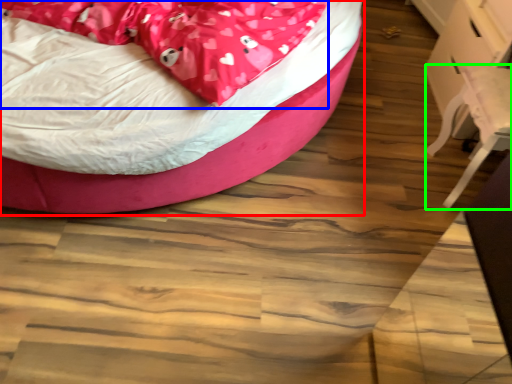
Question: Which object is positioned closest to bed (highlighted by a red box)? Select from blanket (highlighted by a blue box) and swivel chair (highlighted by a green box).

Choices:
 (A) blanket
 (B) swivel chair

Answer: (A)